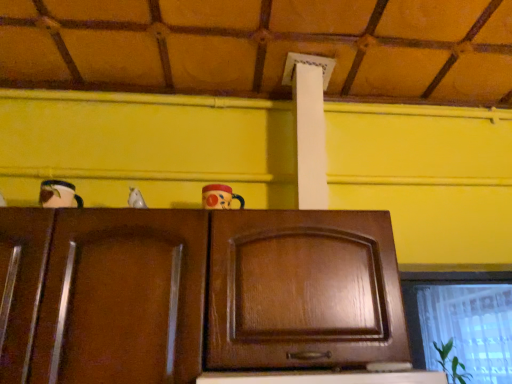
Question: Does dark brown wood cabinet at center have a larger size compared to transparent plastic window at lower right?

Choices:
 (A) yes
 (B) no

Answer: (B)

Question: Would you consider dark brown wood cabinet at center to be distant from transparent plastic window at lower right?

Choices:
 (A) no
 (B) yes

Answer: (B)

Question: Does dark brown wood cabinet at center have a greater width compared to transparent plastic window at lower right?

Choices:
 (A) no
 (B) yes

Answer: (A)

Question: Is dark brown wood cabinet at center outside of transparent plastic window at lower right?

Choices:
 (A) no
 (B) yes

Answer: (B)

Question: Is the depth of dark brown wood cabinet at center greater than that of transparent plastic window at lower right?

Choices:
 (A) yes
 (B) no

Answer: (B)

Question: Does dark brown wood cabinet at center have a lesser height compared to transparent plastic window at lower right?

Choices:
 (A) yes
 (B) no

Answer: (A)

Question: From a real-world perspective, is transparent plastic window at lower right physically above dark brown wood cabinet at center?

Choices:
 (A) no
 (B) yes

Answer: (B)

Question: Can you confirm if transparent plastic window at lower right is wider than dark brown wood cabinet at center?

Choices:
 (A) yes
 (B) no

Answer: (A)

Question: From a real-world perspective, is transparent plastic window at lower right positioned under dark brown wood cabinet at center based on gravity?

Choices:
 (A) yes
 (B) no

Answer: (B)

Question: Is transparent plastic window at lower right positioned with its back to dark brown wood cabinet at center?

Choices:
 (A) yes
 (B) no

Answer: (B)

Question: Is transparent plastic window at lower right taller than dark brown wood cabinet at center?

Choices:
 (A) no
 (B) yes

Answer: (B)

Question: Could you tell me if transparent plastic window at lower right is turned towards dark brown wood cabinet at center?

Choices:
 (A) yes
 (B) no

Answer: (B)

Question: Based on their sizes in the image, would you say dark brown wood cabinet at center is bigger or smaller than transparent plastic window at lower right?

Choices:
 (A) small
 (B) big

Answer: (A)